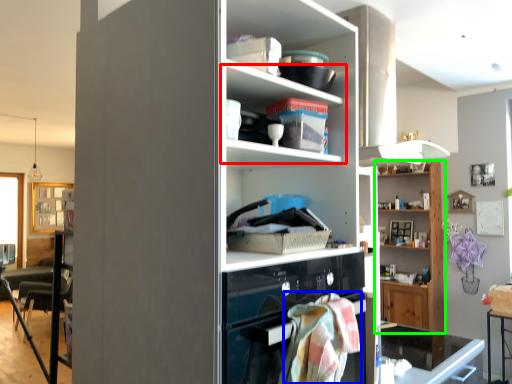
Question: Based on their relative distances, which object is farther from shelf (highlighted by a red box)? Choose from blanket (highlighted by a blue box) and shelf (highlighted by a green box).

Choices:
 (A) blanket
 (B) shelf

Answer: (B)